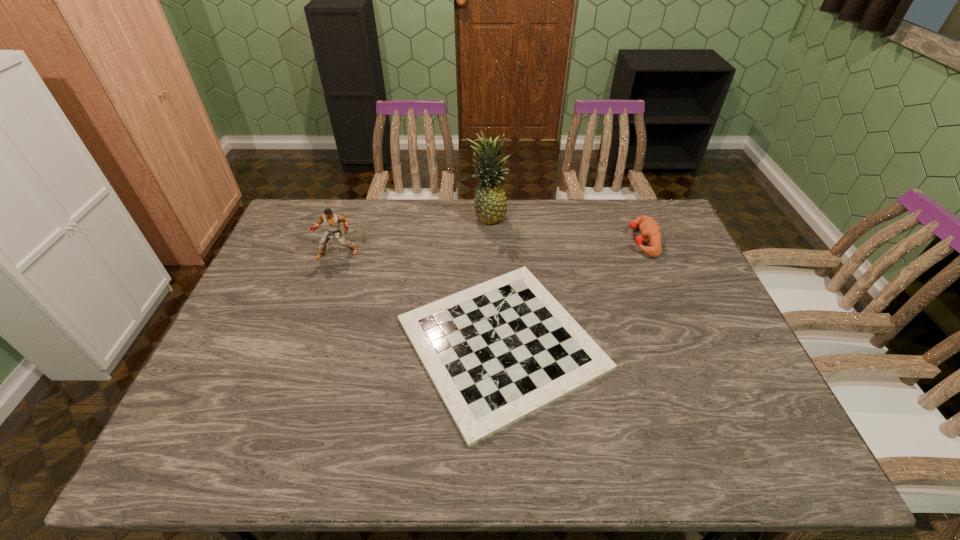
The height and width of the screenshot is (540, 960). I want to click on vacant position located 0.080m with the gloves of the shorter puncher facing forward, so (606, 241).

This screenshot has height=540, width=960. I want to click on free space located with the gloves of the shorter puncher facing forward, so click(521, 241).

The image size is (960, 540). I want to click on free region located 0.230m on the left of the nearest object, so click(x=307, y=343).

Locate an element on the screen. Image resolution: width=960 pixels, height=540 pixels. pineapple situated at the far edge is located at coordinates (490, 202).

Find the location of `puncher that is at the far edge`. puncher that is at the far edge is located at coordinates (650, 231).

At what (x,y) coordinates should I click in order to perform the action: click on object located in the near edge section of the desktop. Please return your answer as a coordinate pair (x, y). Looking at the image, I should click on (497, 352).

Where is `object located at the left edge`? This screenshot has height=540, width=960. object located at the left edge is located at coordinates (332, 221).

Locate an element on the screen. object that is at the right edge is located at coordinates (650, 231).

Image resolution: width=960 pixels, height=540 pixels. Find the location of `object situated at the far right corner`. object situated at the far right corner is located at coordinates (650, 231).

I want to click on free space at the far edge, so click(x=464, y=235).